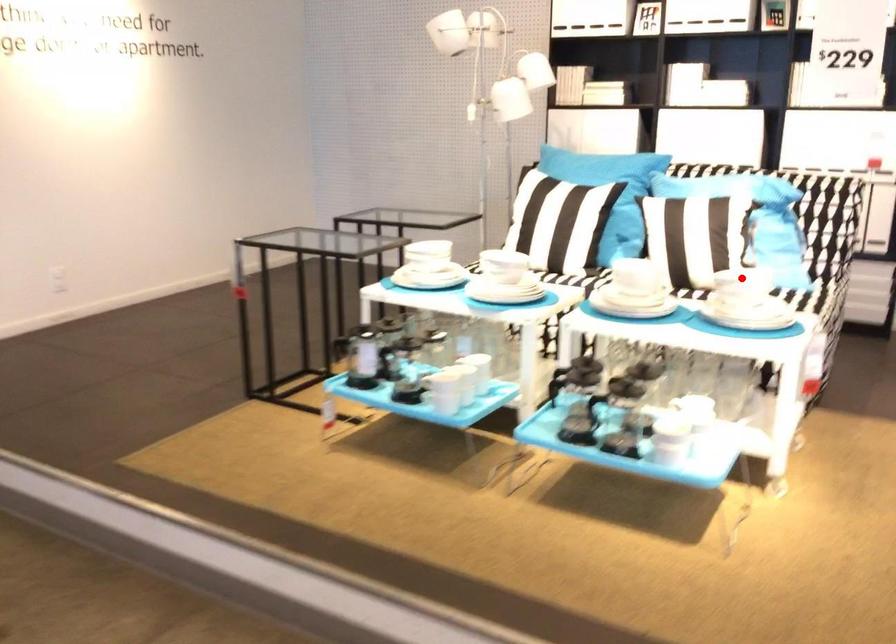
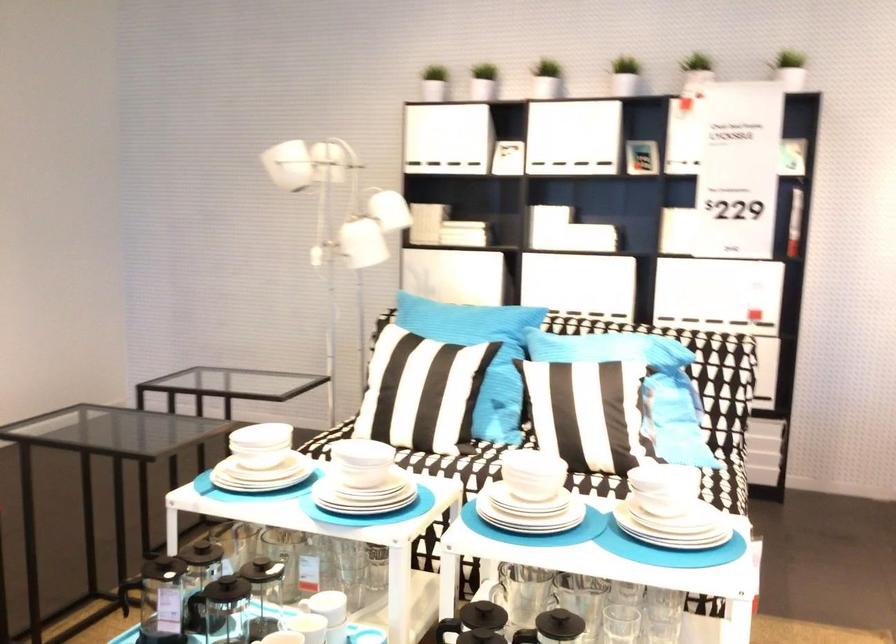
Question: I am providing you with two images of the same scene from different viewpoints. In image1, a red point is highlighted. Considering the same 3D point in image2, which of the following is correct?

Choices:
 (A) It is closer
 (B) It is farther

Answer: (A)